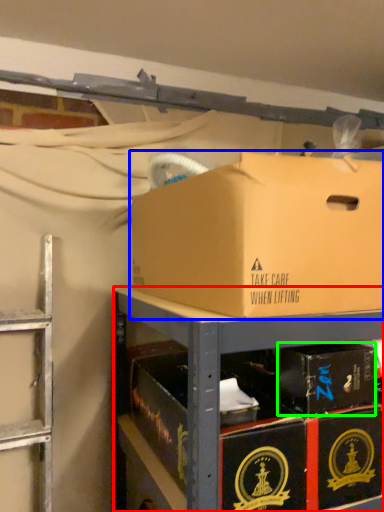
Question: Based on their relative distances, which object is farther from shelf (highlighted by a red box)? Choose from box (highlighted by a blue box) and box (highlighted by a green box).

Choices:
 (A) box
 (B) box

Answer: (B)